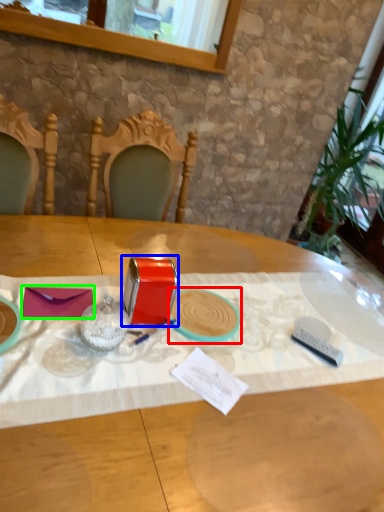
Question: Which object is positioned closest to tableware (highlighted by a red box)? Select from tableware (highlighted by a blue box) and notepad (highlighted by a green box).

Choices:
 (A) tableware
 (B) notepad

Answer: (A)